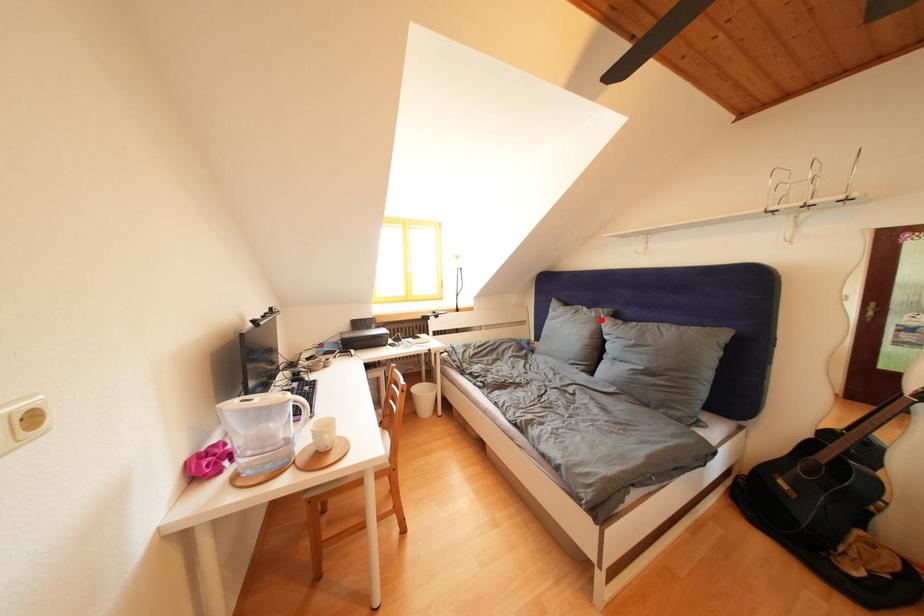
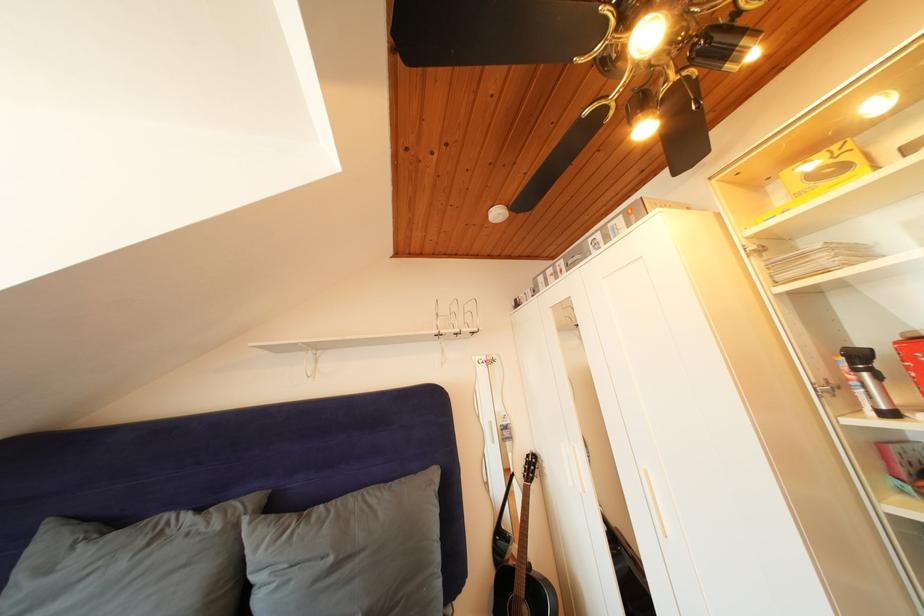
The point at the highlighted location is marked in the first image. Where is the corresponding point in the second image?

(225, 531)